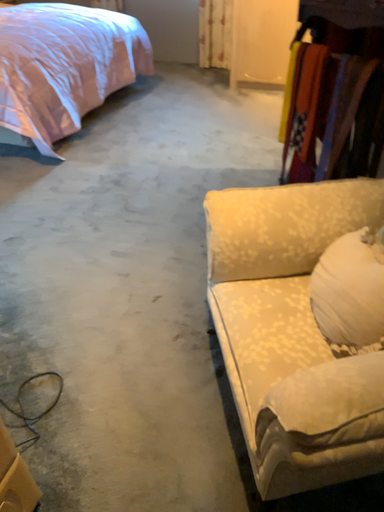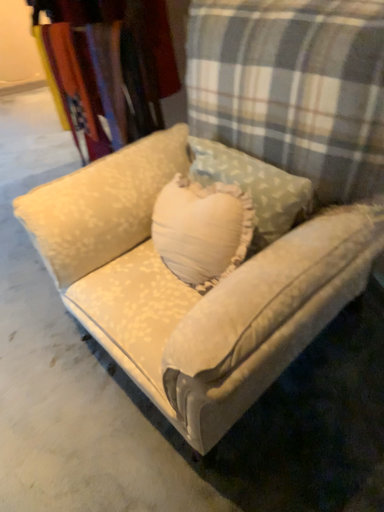
Question: How did the camera likely rotate when shooting the video?

Choices:
 (A) rotated left
 (B) rotated right

Answer: (B)